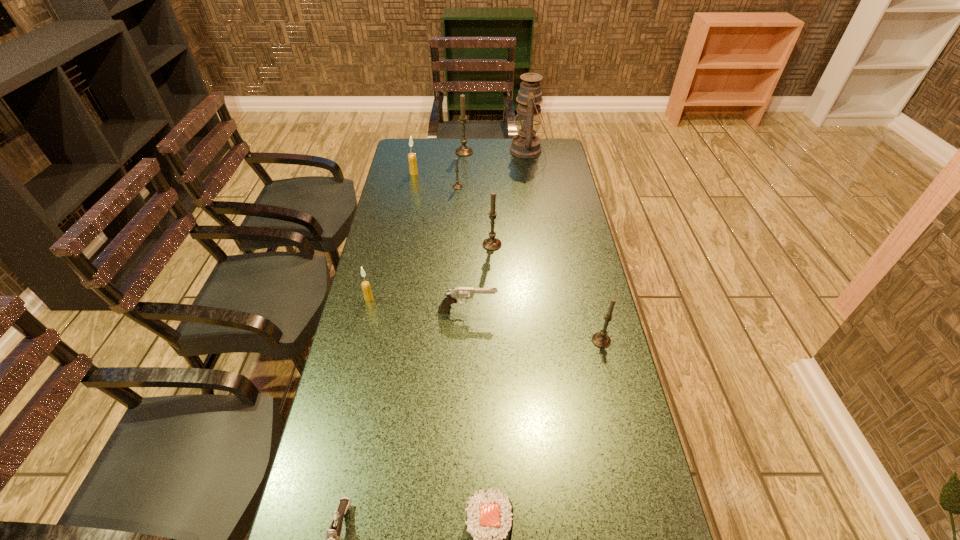
Identify the location of vacant space at the left edge of the desktop. The image size is (960, 540). (385, 356).

The width and height of the screenshot is (960, 540). Find the location of `vacant region at the right edge of the desktop`. vacant region at the right edge of the desktop is located at coordinates (549, 279).

You are a GUI agent. You are given a task and a screenshot of the screen. Output one action in this format:
    pyautogui.click(x=<x>, y=<y>)
    Task: Click on the free location at the far right corner of the desktop
    
    Given the screenshot: What is the action you would take?
    pyautogui.click(x=545, y=154)

Image resolution: width=960 pixels, height=540 pixels. Identify the location of vacant point located between the eighth farthest object and the taller gun. (535, 326).

At what (x,y) coordinates should I click in order to perform the action: click on free space between the tallest object and the third farthest object. Please return your answer as a coordinate pair (x, y). This screenshot has height=540, width=960. Looking at the image, I should click on (470, 161).

The height and width of the screenshot is (540, 960). Find the location of `free spot between the fourth nearest object and the blue oil lamp`. free spot between the fourth nearest object and the blue oil lamp is located at coordinates (497, 231).

I want to click on free space between the fifth farthest candle and the smallest gray candle, so click(x=413, y=242).

Locate an element on the screen. The height and width of the screenshot is (540, 960). free space between the fourth nearest object and the second tallest object is located at coordinates (466, 231).

This screenshot has width=960, height=540. Find the location of `free space between the oil lamp and the second biggest gray candle`. free space between the oil lamp and the second biggest gray candle is located at coordinates (510, 197).

Identify the location of unoccupied position between the right gun and the eighth shortest object. The image size is (960, 540). (480, 278).